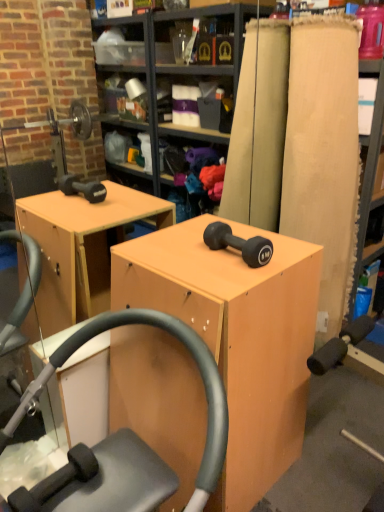
In order to click on vacant region in front of matte black dumbbell at center in this screenshot , I will do `click(231, 279)`.